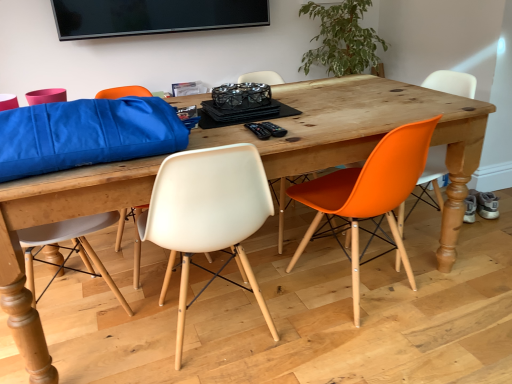
Question: From a real-world perspective, relative to orange plastic chair at right, the third chair positioned from the left, is black plastic remote control at center, which is the second remote control from left to right, vertically above or below?

Choices:
 (A) below
 (B) above

Answer: (B)

Question: Would you say black plastic remote control at center, which is the second remote control from left to right, is to the left or to the right of orange plastic chair at right, the third chair positioned from the left, in the picture?

Choices:
 (A) right
 (B) left

Answer: (B)

Question: Which object is positioned closest to the black plastic remote control at center, which is the 2th remote control in right-to-left order?

Choices:
 (A) orange plastic chair at right, the third chair positioned from the left
 (B) white plastic chair at center, positioned as the first chair in left-to-right order
 (C) orange matte plastic chair at right, which is counted as the second chair, starting from the left
 (D) black plastic remote control at center, which is the second remote control from left to right

Answer: (D)

Question: Estimate the real-world distances between objects in this image. Which object is closer to the orange matte plastic chair at right, which is counted as the second chair, starting from the left?

Choices:
 (A) black plastic remote control at center, which is the second remote control from left to right
 (B) white plastic chair at center, which is the 3th chair from right to left
 (C) black plastic remote control at center, which is the 2th remote control in right-to-left order
 (D) orange plastic chair at right, the 1th chair positioned from the right

Answer: (B)